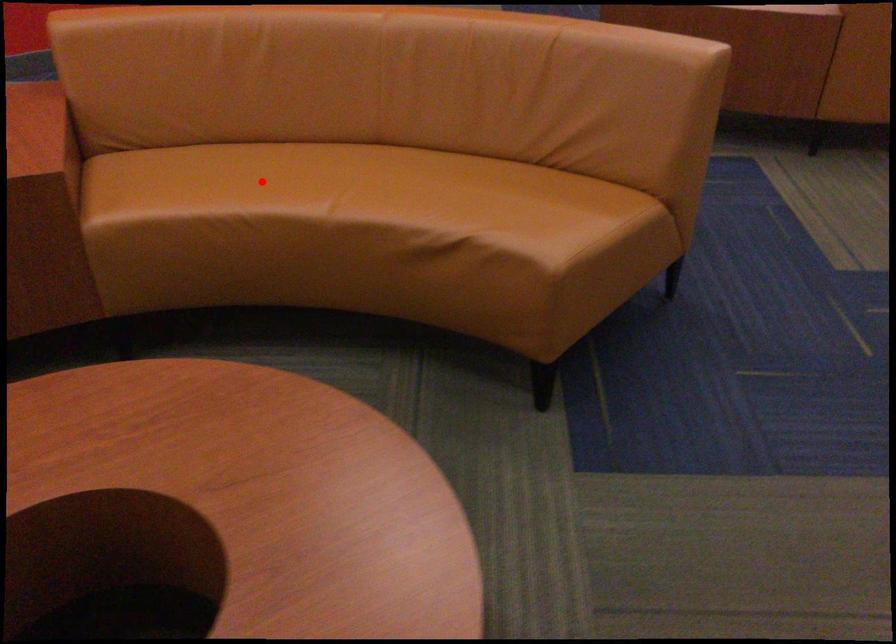
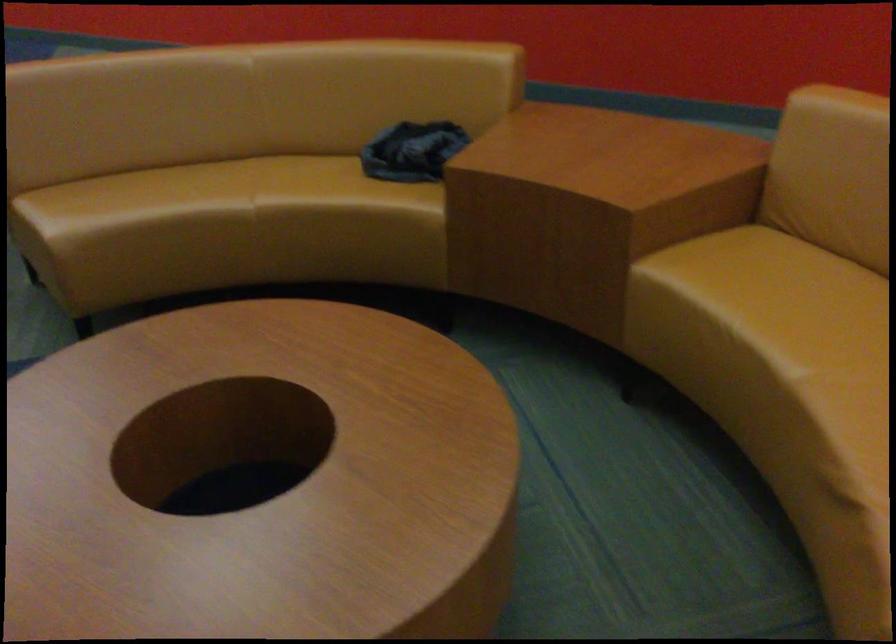
Question: I am providing you with two images of the same scene from different viewpoints. Given a red point in image1, look at the same physical point in image2. Is it:

Choices:
 (A) Closer to the viewpoint
 (B) Farther from the viewpoint

Answer: (A)